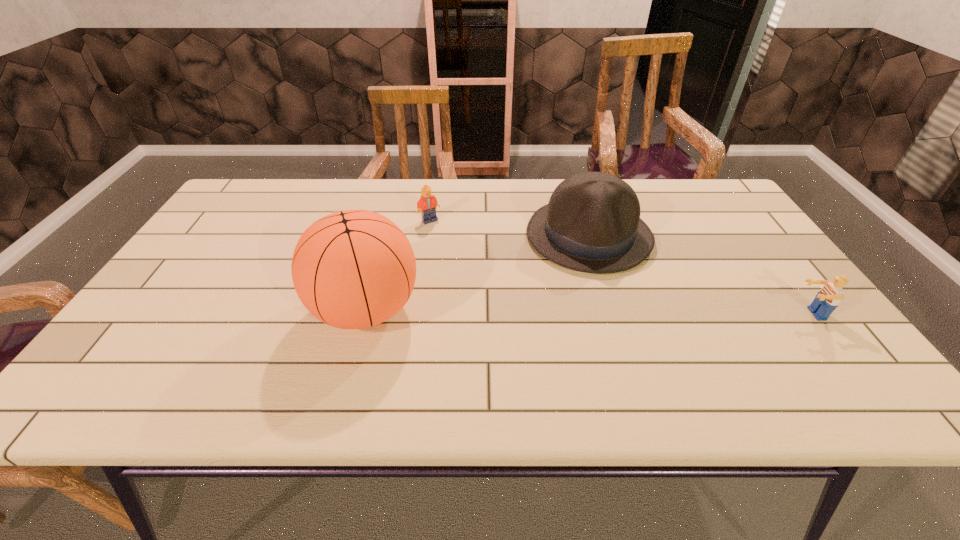
Select which object appears as the second closest to the basketball. Please provide its 2D coordinates. Your answer should be formatted as a tuple, i.e. [(x, y)], where the tuple contains the x and y coordinates of a point satisfying the conditions above.

[(427, 204)]

You are a GUI agent. You are given a task and a screenshot of the screen. Output one action in this format:
    pyautogui.click(x=<x>, y=<y>)
    Task: Click on the object that ranks as the second closest to the basketball
    The height and width of the screenshot is (540, 960).
    Given the screenshot: What is the action you would take?
    pyautogui.click(x=427, y=204)

Locate an element on the screen. This screenshot has width=960, height=540. vacant point that satisfies the following two spatial constraints: 1. on the back side of the basketball; 2. on the left side of the second tallest object is located at coordinates (385, 236).

Image resolution: width=960 pixels, height=540 pixels. I want to click on vacant area that satisfies the following two spatial constraints: 1. on the back side of the farther Lego; 2. on the right side of the escargot, so click(x=350, y=220).

Find the location of a particular element. The width and height of the screenshot is (960, 540). vacant area that satisfies the following two spatial constraints: 1. on the front side of the nearer Lego; 2. on the face of the farther Lego is located at coordinates (416, 314).

Where is `vacant space that satisfies the following two spatial constraints: 1. on the front side of the rightmost object; 2. on the face of the second tallest object`? vacant space that satisfies the following two spatial constraints: 1. on the front side of the rightmost object; 2. on the face of the second tallest object is located at coordinates [612, 314].